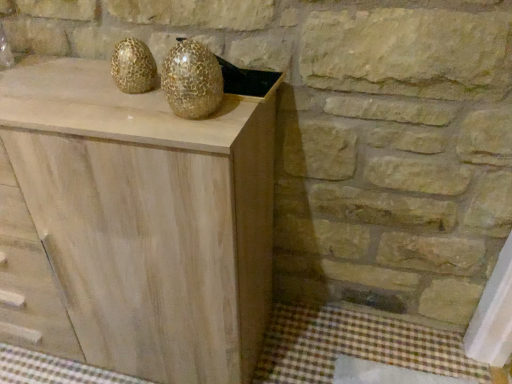
You are a GUI agent. You are given a task and a screenshot of the screen. Output one action in this format:
    pyautogui.click(x=<x>, y=<y>)
    Task: Click on the vacant space to the left of gold textured vase at center
    
    Given the screenshot: What is the action you would take?
    pyautogui.click(x=116, y=108)